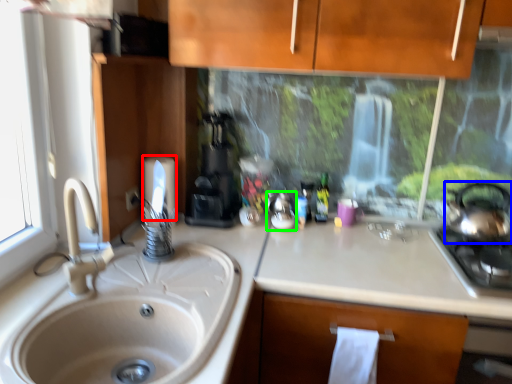
Question: Based on their relative distances, which object is farther from toilet paper (highlighted by a red box)? Choose from tea pot (highlighted by a blue box) and appliance (highlighted by a green box).

Choices:
 (A) tea pot
 (B) appliance

Answer: (A)